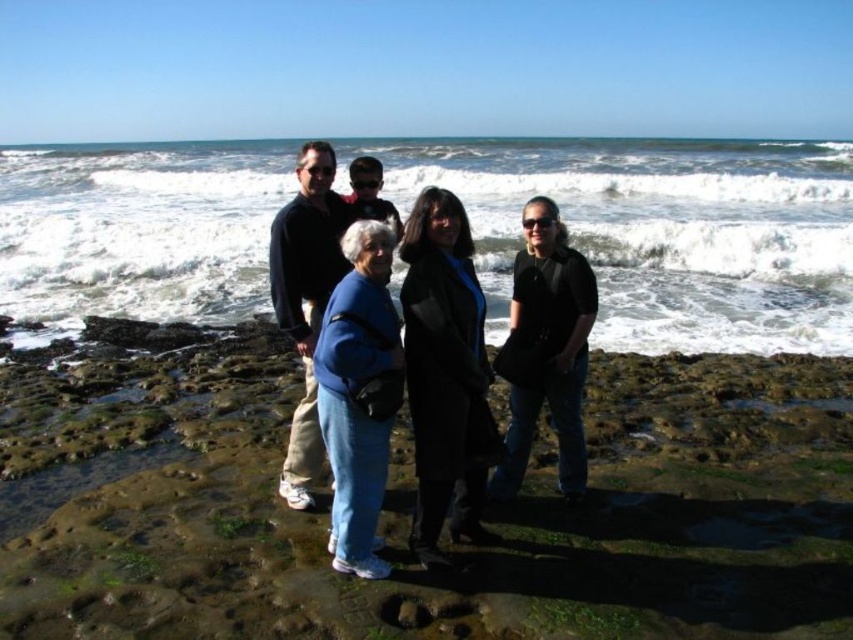
Looking at this image, does green mossy rocks at center lie behind black matte jacket at center?

No, green mossy rocks at center is closer to the viewer.

Can you confirm if green mossy rocks at center is positioned to the left of black matte jacket at center?

Yes, green mossy rocks at center is to the left of black matte jacket at center.

Is point (148, 548) closer to camera compared to point (509, 328)?

Yes, it is.

Find the location of a particular element. green mossy rocks at center is located at coordinates (410, 508).

Between point (152, 144) and point (474, 356), which one is positioned behind?

The point (152, 144) is behind.

Does white frothy wave at upper center have a larger size compared to black matte coat at center?

Yes.

Which is behind, point (196, 257) or point (410, 396)?

The point (196, 257) is more distant.

Find the location of a particular element. The image size is (853, 640). white frothy wave at upper center is located at coordinates (660, 230).

Who is positioned more to the right, blue fleece jacket at center or black matte jacket at center?

From the viewer's perspective, black matte jacket at center appears more on the right side.

In the scene shown: Which is below, blue fleece jacket at center or black matte jacket at center?

blue fleece jacket at center is below.

Identify the location of blue fleece jacket at center. coord(358,394).